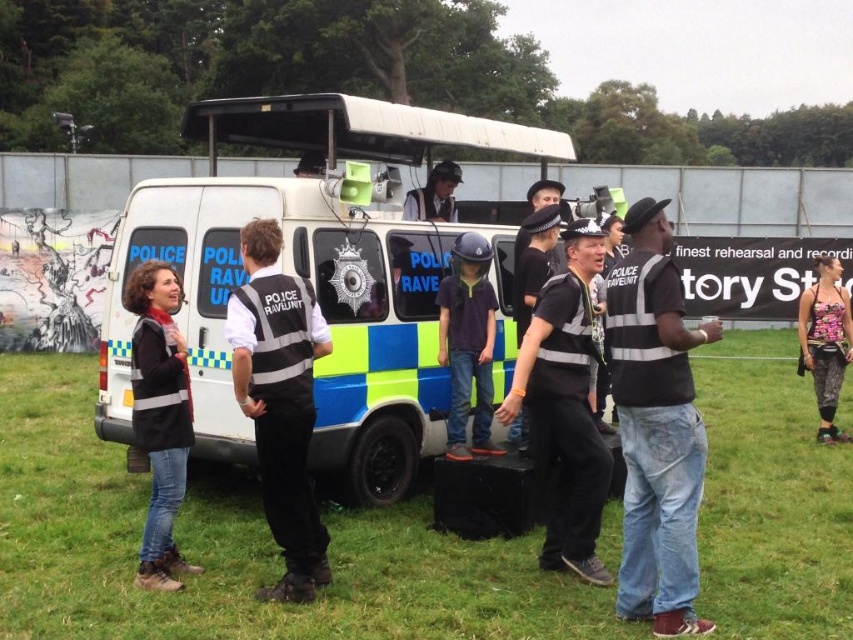
Can you confirm if black matte jacket at left is positioned to the left of camouflage leggings at center?

Indeed, black matte jacket at left is positioned on the left side of camouflage leggings at center.

Is black matte jacket at left smaller than camouflage leggings at center?

Yes, black matte jacket at left is smaller than camouflage leggings at center.

Locate an element on the screen. The image size is (853, 640). black matte jacket at left is located at coordinates (160, 416).

Is black reflective vest at center to the left of dark blue uniform at center from the viewer's perspective?

Incorrect, black reflective vest at center is not on the left side of dark blue uniform at center.

Measure the distance between point (664, 470) and camera.

A distance of 4.44 meters exists between point (664, 470) and camera.

Between point (630, 492) and point (460, 285), which one is positioned in front?

Positioned in front is point (630, 492).

The width and height of the screenshot is (853, 640). Find the location of `black reflective vest at center`. black reflective vest at center is located at coordinates (656, 428).

Image resolution: width=853 pixels, height=640 pixels. What do you see at coordinates (160, 416) in the screenshot? I see `black matte jacket at left` at bounding box center [160, 416].

Is black matte jacket at left smaller than dark blue uniform at center?

Yes, black matte jacket at left is smaller than dark blue uniform at center.

You are a GUI agent. You are given a task and a screenshot of the screen. Output one action in this format:
    pyautogui.click(x=<x>, y=<y>)
    Task: Click on the black matte jacket at left
    Image resolution: width=853 pixels, height=640 pixels.
    Given the screenshot: What is the action you would take?
    pyautogui.click(x=160, y=416)